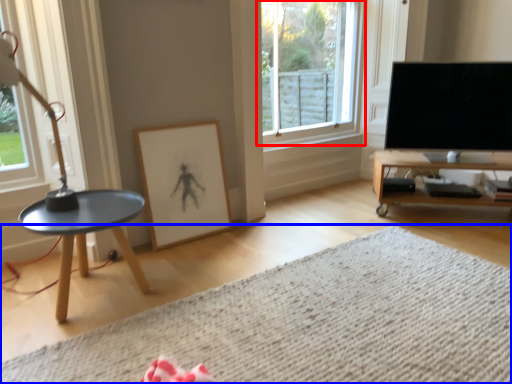
Question: Which point is further to the camera, window (highlighted by a red box) or plain (highlighted by a blue box)?

Choices:
 (A) window
 (B) plain

Answer: (A)